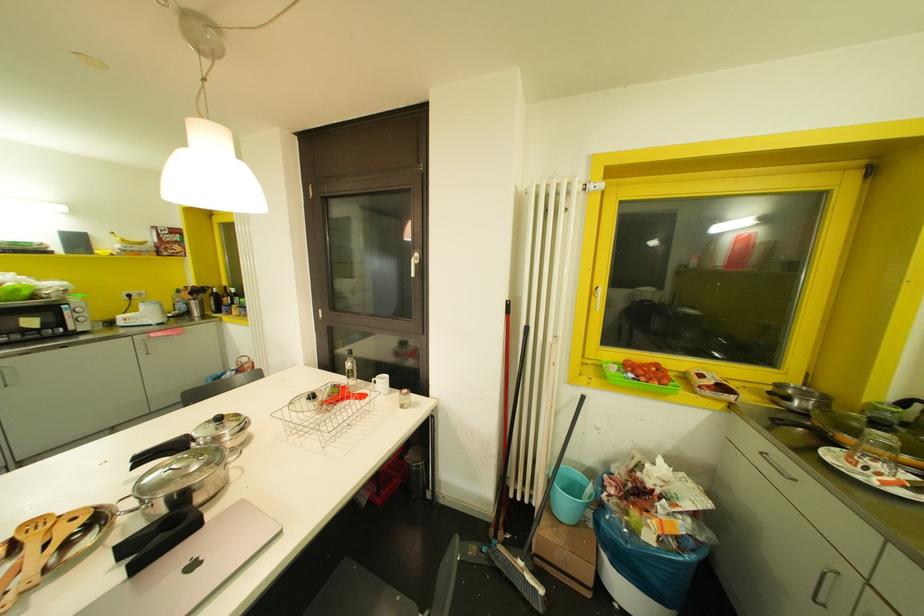
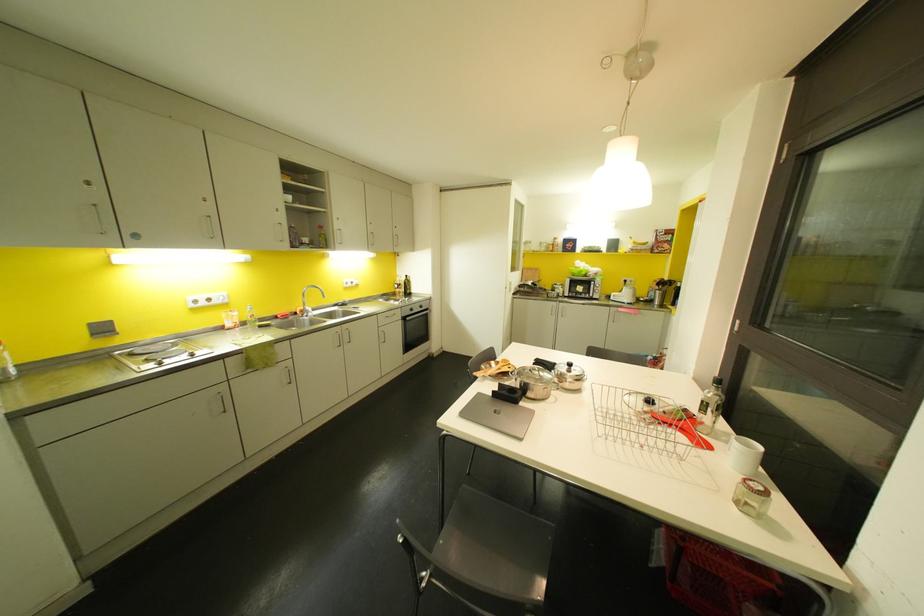
Find the pixel in the second image that matches [400,407] in the first image.

(736, 501)